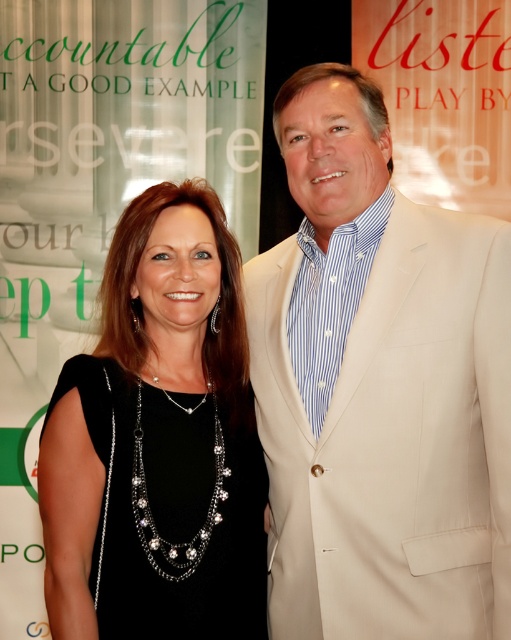
You are a photographer adjusting camera settings for a group photo. You need to ensure both the beige textured suit at right and the black satin dress at center are in focus. Which object should you focus on first to account for their sizes?

The beige textured suit at right is taller than the black satin dress at center, so you should focus on the beige textured suit at right first to ensure proper depth of field.

You are standing at the center of the image and want to move towards the two points labeled as point (276, 284) and point (112, 241). Which point is closer to you?

Point (112, 241) is closer to you because it is in front of point (276, 284), which is behind it.